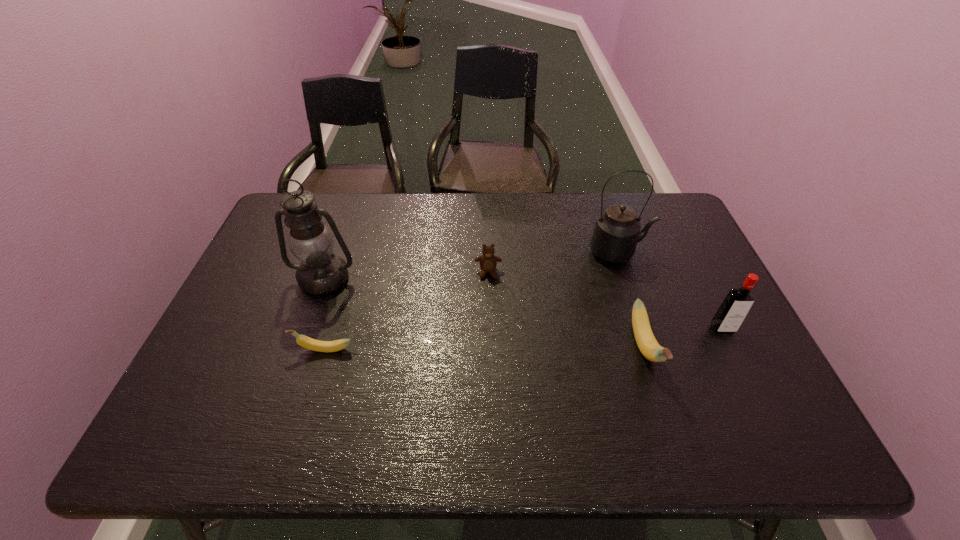
Image resolution: width=960 pixels, height=540 pixels. What are the coordinates of `vodka situated at the right edge` in the screenshot? It's located at (733, 310).

Where is `vacant space at the far edge of the desktop`? Image resolution: width=960 pixels, height=540 pixels. vacant space at the far edge of the desktop is located at coordinates (366, 196).

Image resolution: width=960 pixels, height=540 pixels. What are the coordinates of `free space at the near edge` in the screenshot? It's located at (646, 375).

Find the location of a particular element. This screenshot has height=540, width=960. vacant region at the left edge of the desktop is located at coordinates (281, 288).

This screenshot has height=540, width=960. Find the location of `vacant space at the far left corner of the desktop`. vacant space at the far left corner of the desktop is located at coordinates (287, 232).

Where is `vacant region at the far right corner`? vacant region at the far right corner is located at coordinates (656, 205).

Image resolution: width=960 pixels, height=540 pixels. In the image, there is a desktop. Identify the location of vacant space at the near right corner. (777, 401).

Image resolution: width=960 pixels, height=540 pixels. In order to click on vacant area between the oil lamp and the kettle in this screenshot , I will do `click(472, 265)`.

Where is `free space between the fourth object from right to left and the fourth shortest object`? Image resolution: width=960 pixels, height=540 pixels. free space between the fourth object from right to left and the fourth shortest object is located at coordinates (605, 300).

This screenshot has height=540, width=960. Find the location of `empty space between the oil lamp and the vodka`. empty space between the oil lamp and the vodka is located at coordinates (523, 303).